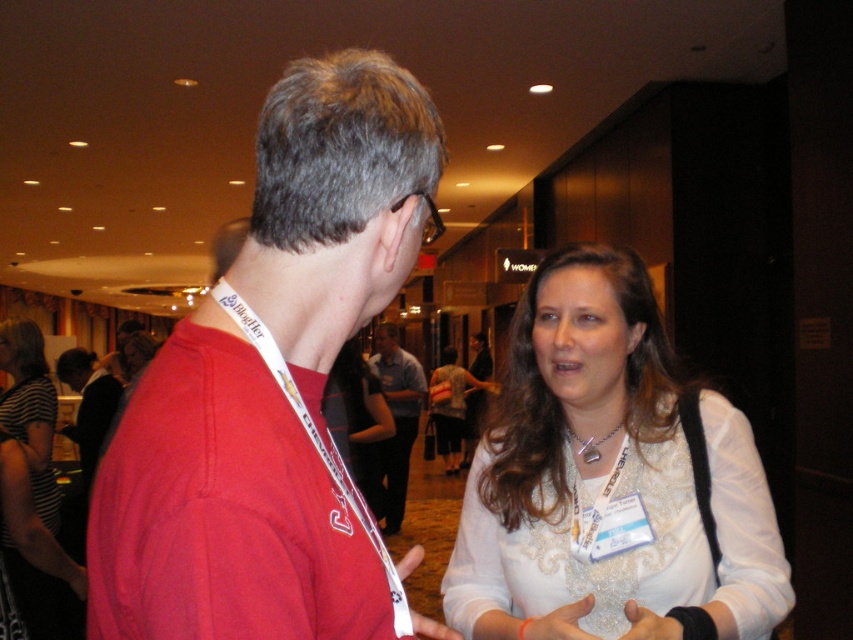
You are a photographer at a formal event and need to capture a closeup of the white satin blouse at center and the silver metallic necklace at center. Which one is located to the left of the other?

The white satin blouse at center is positioned on the left side of the silver metallic necklace at center.